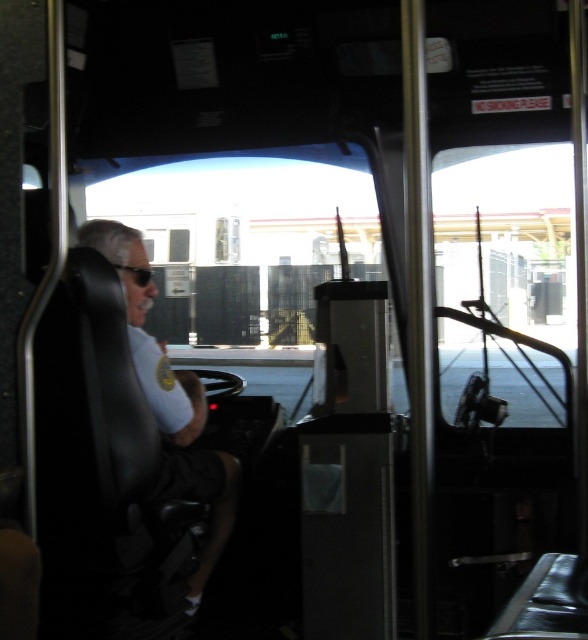
Can you confirm if matte black shirt at left is bigger than black rubber goggles at upper left?

Indeed, matte black shirt at left has a larger size compared to black rubber goggles at upper left.

Image resolution: width=588 pixels, height=640 pixels. Identify the location of matte black shirt at left. (162, 372).